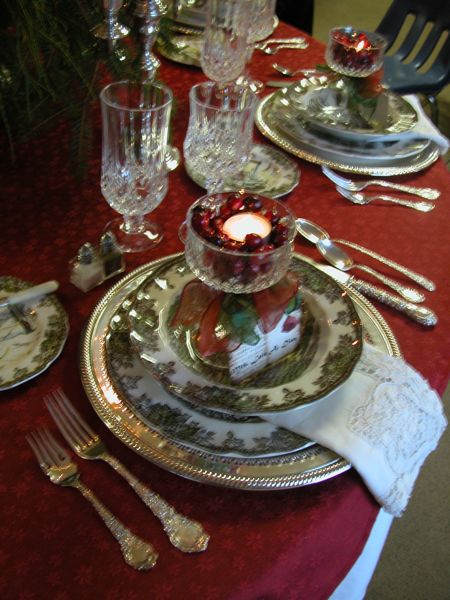
I want to click on fork, so click(x=54, y=460), click(x=73, y=414), click(x=332, y=176).